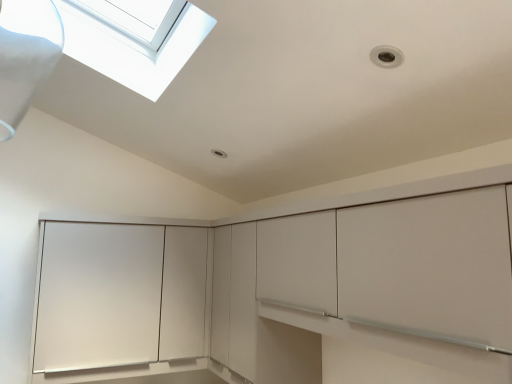
Image resolution: width=512 pixels, height=384 pixels. What do you see at coordinates (119, 296) in the screenshot?
I see `matte white cabinet at lower left` at bounding box center [119, 296].

Locate an element on the screen. This screenshot has width=512, height=384. matte white cabinet at lower left is located at coordinates [119, 296].

Image resolution: width=512 pixels, height=384 pixels. Find the location of `matte white cabinet at center`. matte white cabinet at center is located at coordinates (374, 280).

Describe the element at coordinates (374, 280) in the screenshot. I see `matte white cabinet at center` at that location.

Where is `matte white cabinet at lower left`? matte white cabinet at lower left is located at coordinates (119, 296).

Which is more to the left, matte white cabinet at lower left or matte white cabinet at center?

Positioned to the left is matte white cabinet at lower left.

Is matte white cabinet at lower left behind matte white cabinet at center?

Yes, it is.

Is point (140, 298) in front of point (89, 368)?

That is False.

From the image's perspective, is matte white cabinet at lower left positioned above or below matte white cabinet at center?

matte white cabinet at lower left is situated lower than matte white cabinet at center in the image.

From a real-world perspective, is matte white cabinet at lower left located beneath matte white cabinet at center?

Yes, from a real-world perspective, matte white cabinet at lower left is beneath matte white cabinet at center.

Looking at their sizes, would you say matte white cabinet at lower left is wider or thinner than matte white cabinet at center?

Clearly, matte white cabinet at lower left has more width compared to matte white cabinet at center.

Does matte white cabinet at lower left have a lesser height compared to matte white cabinet at center?

Indeed, matte white cabinet at lower left has a lesser height compared to matte white cabinet at center.

Is matte white cabinet at lower left bigger or smaller than matte white cabinet at center?

Considering their sizes, matte white cabinet at lower left takes up less space than matte white cabinet at center.

Is matte white cabinet at center a part of matte white cabinet at lower left?

Definitely not — matte white cabinet at center is not inside matte white cabinet at lower left.

Can you see matte white cabinet at lower left touching matte white cabinet at center?

No.

Is matte white cabinet at lower left facing away from matte white cabinet at center?

No, matte white cabinet at lower left is not facing the opposite direction of matte white cabinet at center.

Measure the distance between matte white cabinet at lower left and matte white cabinet at center.

They are 78.42 centimeters apart.

This screenshot has width=512, height=384. I want to click on glass door on the left of matte white cabinet at center, so click(x=119, y=296).

Visually, is matte white cabinet at center positioned to the left or to the right of matte white cabinet at lower left?

Clearly, matte white cabinet at center is on the right of matte white cabinet at lower left in the image.

Between matte white cabinet at center and matte white cabinet at lower left, which one is positioned in front?

matte white cabinet at center is more forward.

Considering the points (304, 281) and (123, 335), which point is behind, point (304, 281) or point (123, 335)?

Point (123, 335)

From the image's perspective, between matte white cabinet at center and matte white cabinet at lower left, who is located below?

matte white cabinet at lower left, from the image's perspective.

From a real-world perspective, is matte white cabinet at center over matte white cabinet at lower left?

Yes, from a real-world perspective, matte white cabinet at center is above matte white cabinet at lower left.

Can you confirm if matte white cabinet at center is thinner than matte white cabinet at lower left?

Yes, matte white cabinet at center is thinner than matte white cabinet at lower left.

Which of these two, matte white cabinet at center or matte white cabinet at lower left, stands taller?

Standing taller between the two is matte white cabinet at center.

Considering the sizes of matte white cabinet at center and matte white cabinet at lower left in the image, is matte white cabinet at center bigger or smaller than matte white cabinet at lower left?

Considering their sizes, matte white cabinet at center takes up more space than matte white cabinet at lower left.

Is matte white cabinet at center inside the boundaries of matte white cabinet at lower left, or outside?

matte white cabinet at center cannot be found inside matte white cabinet at lower left.

Is matte white cabinet at center positioned far away from matte white cabinet at lower left?

matte white cabinet at center is actually quite close to matte white cabinet at lower left.

Is matte white cabinet at center facing away from matte white cabinet at lower left?

matte white cabinet at center does not have its back to matte white cabinet at lower left.

How many degrees apart are the facing directions of matte white cabinet at center and matte white cabinet at lower left?

89.6 degrees.

Where is `glass door below the matte white cabinet at center (from a real-world perspective)`? Image resolution: width=512 pixels, height=384 pixels. glass door below the matte white cabinet at center (from a real-world perspective) is located at coordinates (119, 296).

I want to click on glass door that is below the matte white cabinet at center (from the image's perspective), so click(119, 296).

This screenshot has height=384, width=512. I want to click on cabinetry on the right of matte white cabinet at lower left, so click(374, 280).